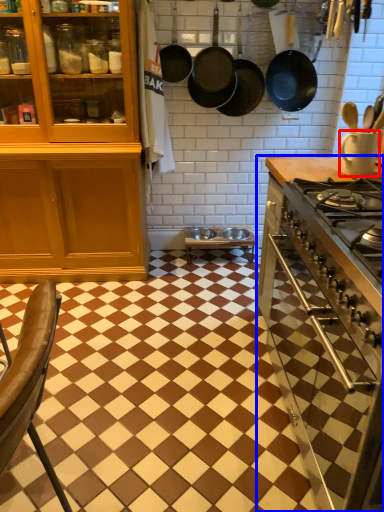
Question: Which object is further to the camera taking this photo, kitchen appliance (highlighted by a red box) or countertop (highlighted by a blue box)?

Choices:
 (A) kitchen appliance
 (B) countertop

Answer: (A)